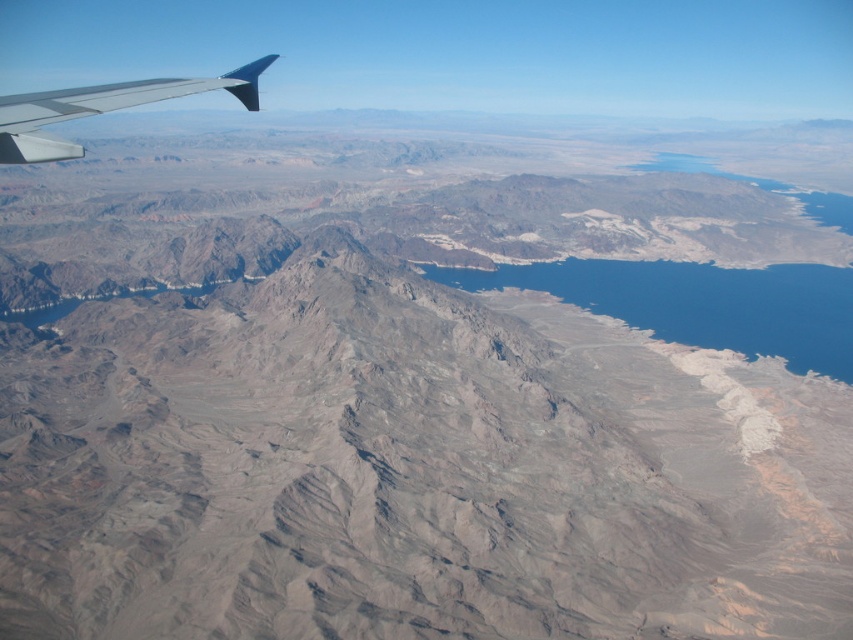
Question: Does blue water at center have a smaller size compared to metallic gray wing at upper left?

Choices:
 (A) yes
 (B) no

Answer: (A)

Question: Is blue water at center further to the viewer compared to metallic gray wing at upper left?

Choices:
 (A) no
 (B) yes

Answer: (B)

Question: Does blue water at center come in front of metallic gray wing at upper left?

Choices:
 (A) no
 (B) yes

Answer: (A)

Question: Among these objects, which one is farthest from the camera?

Choices:
 (A) metallic gray wing at upper left
 (B) blue water at center

Answer: (B)

Question: Which of the following is the farthest from the observer?

Choices:
 (A) (32, 134)
 (B) (646, 296)

Answer: (B)